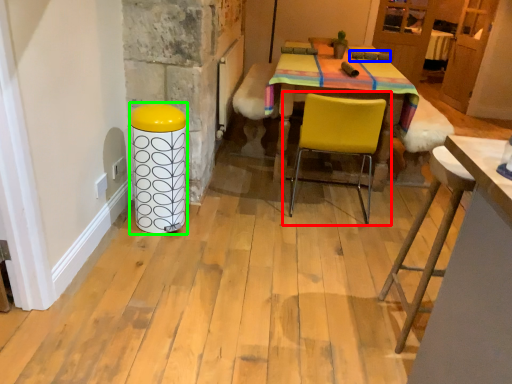
Question: Which is nearer to the chair (highlighted by a red box)? armchair (highlighted by a blue box) or bar stool (highlighted by a green box).

Choices:
 (A) armchair
 (B) bar stool

Answer: (B)